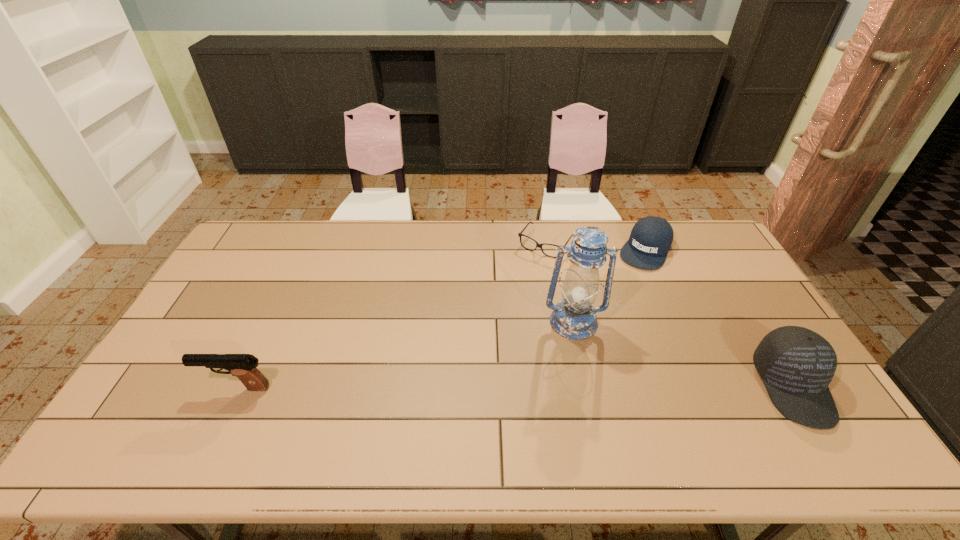
I want to click on baseball cap positioned at the far edge, so click(650, 239).

Identify the location of spectacles that is at the far edge. The height and width of the screenshot is (540, 960). (520, 234).

The image size is (960, 540). What are the coordinates of `pistol at the near edge` in the screenshot? It's located at (243, 366).

Locate an element on the screen. This screenshot has height=540, width=960. baseball cap that is at the near edge is located at coordinates (796, 364).

Image resolution: width=960 pixels, height=540 pixels. What are the coordinates of `object at the left edge` in the screenshot? It's located at (243, 366).

The height and width of the screenshot is (540, 960). I want to click on object at the right edge, so click(x=796, y=364).

Where is `object present at the near left corner`? The image size is (960, 540). object present at the near left corner is located at coordinates (243, 366).

This screenshot has height=540, width=960. Find the location of `object that is positioned at the near right corner`. object that is positioned at the near right corner is located at coordinates (796, 364).

Locate an element on the screen. free space at the far edge of the desktop is located at coordinates (612, 244).

Where is `free space at the near edge of the desktop`? free space at the near edge of the desktop is located at coordinates (529, 414).